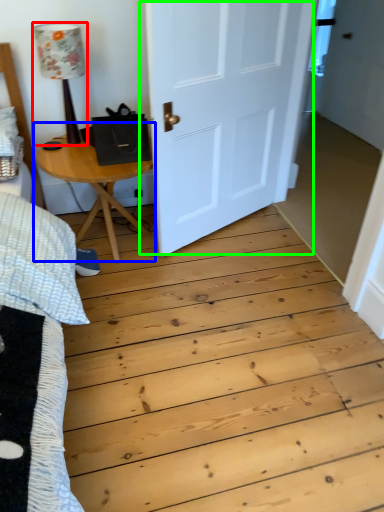
Question: Which is farther away from lamp (highlighted by a red box)? table (highlighted by a blue box) or door (highlighted by a green box)?

Choices:
 (A) table
 (B) door

Answer: (B)